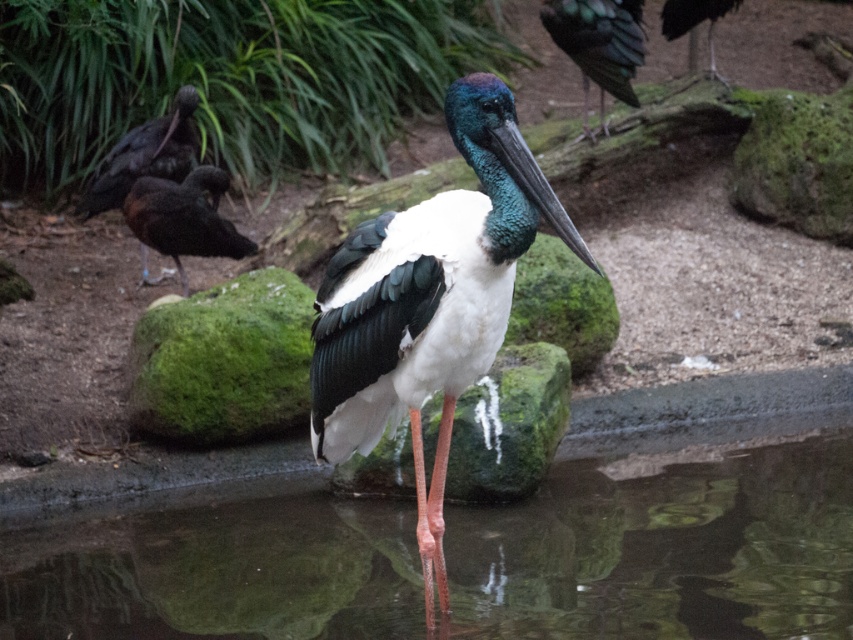
You are a birdwatcher observing the black necked stork and the ibises in the scene. You notice two points marked in the image. Which point is closer to you, point (625, 484) or point (666, 19)?

Point (625, 484) is closer to you because it is in front of point (666, 19).

You are a wildlife photographer aiming to capture the white glossy stork at center and the shiny black bird at upper right in a single frame. Based on their sizes, which bird should you focus on to ensure both fit comfortably in the photo without cropping?

The white glossy stork at center is larger in width than the shiny black bird at upper right. To ensure both fit comfortably in the photo without cropping, focus on the white glossy stork at center as the primary subject and adjust the frame to accommodate its larger size while including the smaller shiny black bird at upper right.